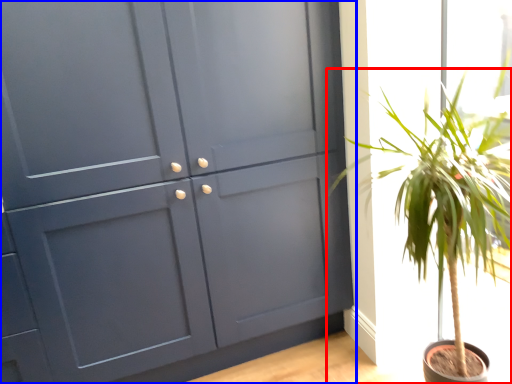
Question: Which object appears closest to the camera in this image, houseplant (highlighted by a red box) or cupboard (highlighted by a blue box)?

Choices:
 (A) houseplant
 (B) cupboard

Answer: (A)